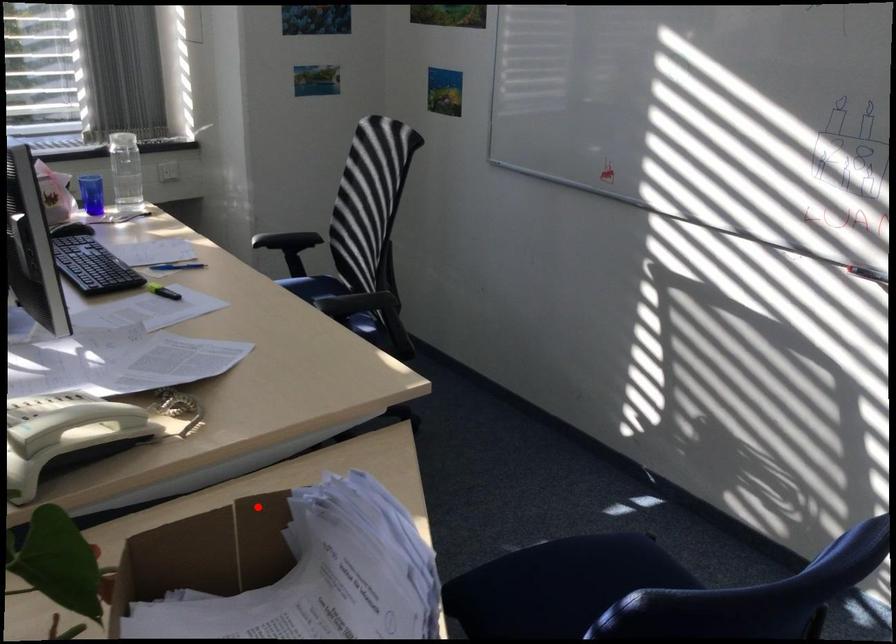
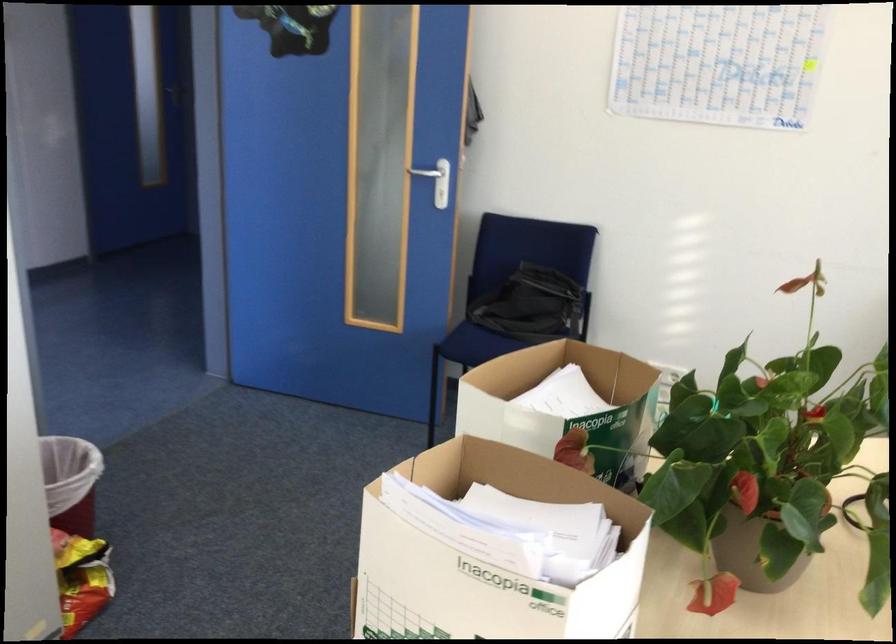
Where in the second image is the point corresponding to the highlighted location from the first image?

(489, 558)